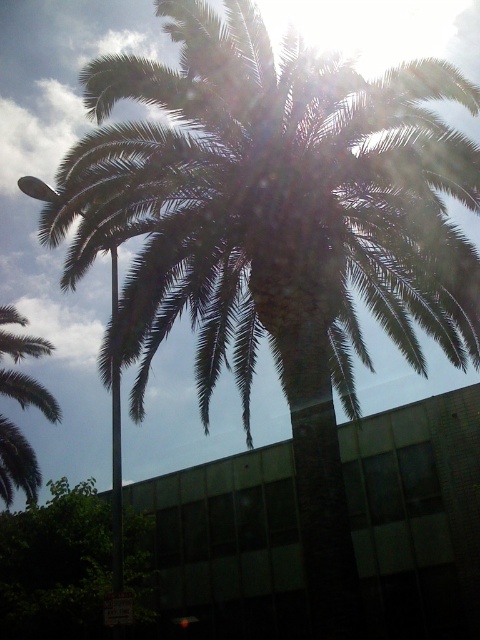
You are standing in front of the palm tree and want to take a photo that includes both the palm tree and the green leafy tree at lower left. Given that your camera has a maximum focus range of 10 meters, will both objects be in focus?

The green leafy tree at lower left is 12.85 meters away from camera, which exceeds the camera maximum focus range of 10 meters. Therefore, the green leafy tree at lower left will be out of focus while the palm tree, which is closer, will be in focus.

You are standing in the scene and want to place a small decoration between the two points, point (x=63, y=572) and point (x=34, y=353). Which point should you place it closer to if you want the decoration to be more visible to someone approaching from the front?

You should place the decoration closer to point (x=63, y=572) because it is closer to the viewer, making the decoration more visible to someone approaching from the front.

You are a photographer trying to capture a photo of the green leafy tree at lower left and the green leafy palm at upper left. Which tree should you focus on first if you want to ensure both are in focus without adjusting the camera settings?

You should focus on the green leafy palm at upper left first because it is farther away from the viewer than the green leafy tree at lower left. By focusing on the farther object, the closer one may still be within the depth of field, ensuring both are in focus.